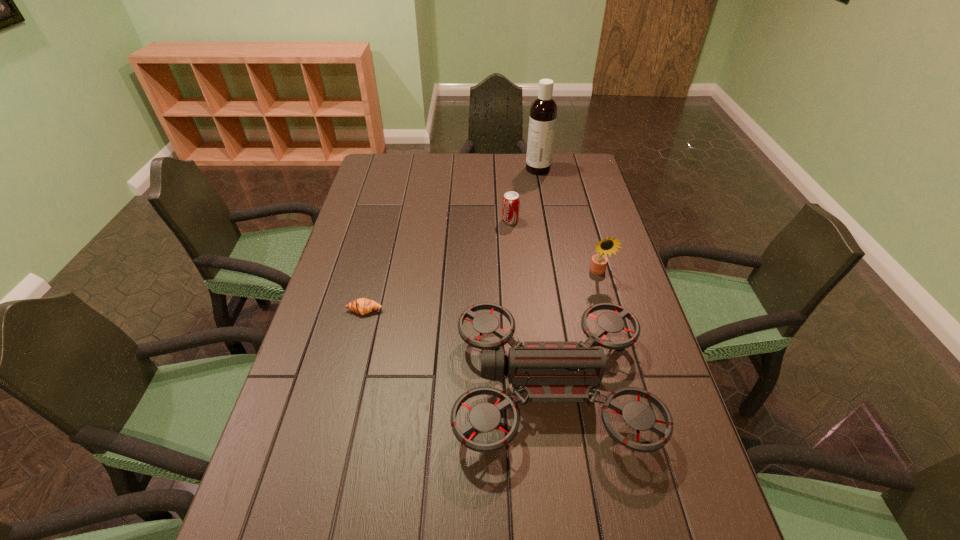
At what (x,y) coordinates should I click in order to perform the action: click on free space between the nearest object and the third nearest object. Please return your answer as a coordinate pair (x, y). The height and width of the screenshot is (540, 960). Looking at the image, I should click on (574, 329).

Image resolution: width=960 pixels, height=540 pixels. Find the location of `vacant space that's between the dishwasher detergent and the shortest object`. vacant space that's between the dishwasher detergent and the shortest object is located at coordinates (451, 240).

Identify the location of vacant space that is in between the dishwasher detergent and the third tallest object. (544, 278).

The image size is (960, 540). In order to click on free space between the dishwasher detergent and the second farthest object in this screenshot , I will do `click(524, 195)`.

Find the location of a particular element. This screenshot has width=960, height=540. empty space that is in between the dishwasher detergent and the third tallest object is located at coordinates (544, 278).

The height and width of the screenshot is (540, 960). I want to click on empty space between the soda can and the farthest object, so click(x=524, y=195).

Select which object appears as the fourth closest to the second shortest object. Please provide its 2D coordinates. Your answer should be formatted as a tuple, i.e. [(x, y)], where the tuple contains the x and y coordinates of a point satisfying the conditions above.

[(362, 306)]

The height and width of the screenshot is (540, 960). What are the coordinates of `object that ranks as the third closest to the third nearest object` in the screenshot? It's located at (543, 112).

Locate an element on the screen. The height and width of the screenshot is (540, 960). vacant region that satisfies the following two spatial constraints: 1. on the face of the third nearest object; 2. on the front-facing side of the third shortest object is located at coordinates (630, 386).